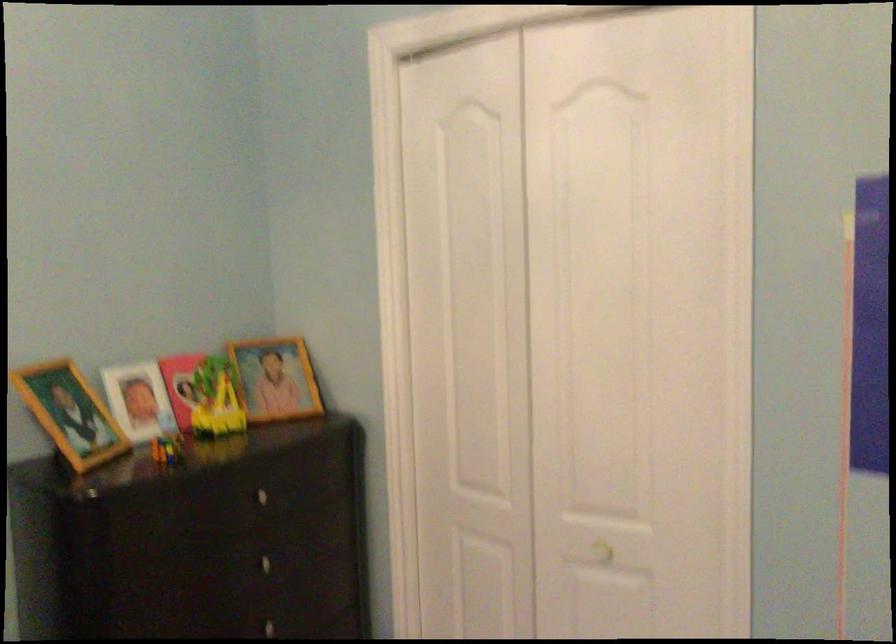
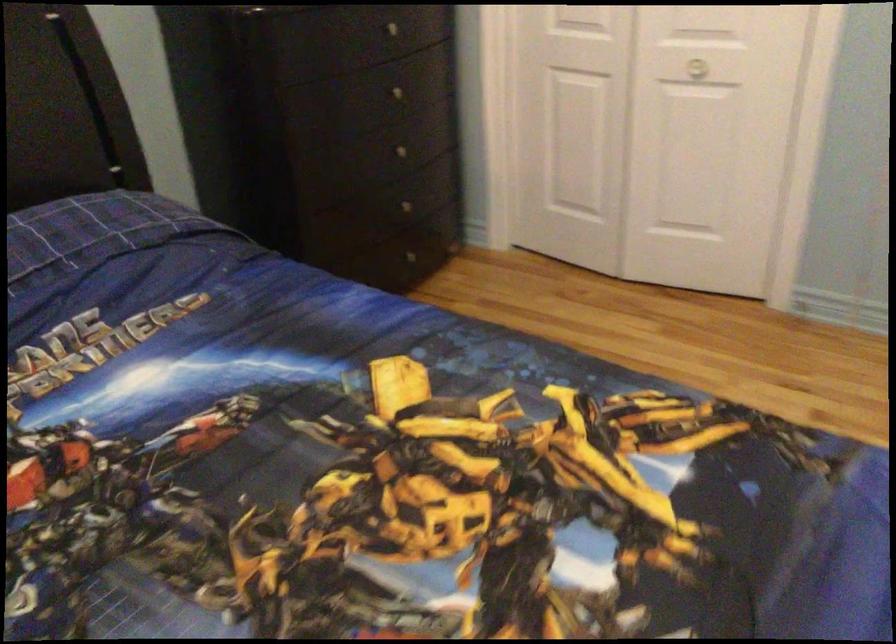
Question: The first image is from the beginning of the video and the second image is from the end. How did the camera likely rotate when shooting the video?

Choices:
 (A) Left
 (B) Right
 (C) Up
 (D) Down

Answer: (D)